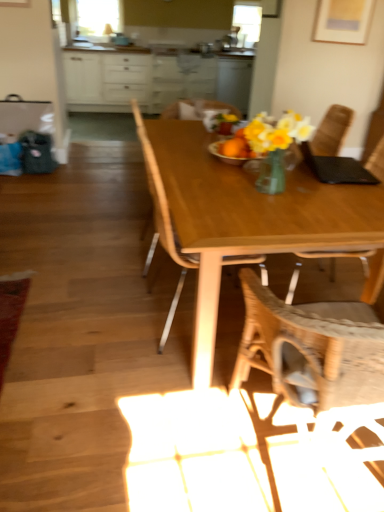
This screenshot has width=384, height=512. Describe the element at coordinates (162, 222) in the screenshot. I see `wooden chair at center, the first chair positioned from the left` at that location.

This screenshot has width=384, height=512. What do you see at coordinates (99, 18) in the screenshot?
I see `clear glass window screen at upper left` at bounding box center [99, 18].

Describe the element at coordinates (363, 288) in the screenshot. I see `wooden chair at center, marked as the third chair in a left-to-right arrangement` at that location.

In order to face wooden chair at center, positioned as the first chair in right-to-left order, should I rotate leftwards or rightwards?

Rotate your view right by about 18.159°.

The width and height of the screenshot is (384, 512). What do you see at coordinates (244, 217) in the screenshot?
I see `wooden table at center` at bounding box center [244, 217].

At what (x,y) coordinates should I click in order to perform the action: click on woven fabric chair at center, acting as the 2th chair starting from the left. Please return your answer as a coordinate pair (x, y). The width and height of the screenshot is (384, 512). Looking at the image, I should click on (313, 359).

Is white glossy cabinets at upper center in contact with wooden chair at center, positioned as the first chair in right-to-left order?

No, white glossy cabinets at upper center is not with wooden chair at center, positioned as the first chair in right-to-left order.

Looking at this image, considering the sizes of objects white glossy cabinets at upper center and wooden chair at center, positioned as the first chair in right-to-left order, in the image provided, who is wider, white glossy cabinets at upper center or wooden chair at center, positioned as the first chair in right-to-left order,?

Wider between the two is white glossy cabinets at upper center.

Is white glossy cabinets at upper center oriented away from wooden chair at center, positioned as the first chair in right-to-left order?

That's not correct — white glossy cabinets at upper center is not looking away from wooden chair at center, positioned as the first chair in right-to-left order.

Is white glossy cabinets at upper center positioned beyond the bounds of wooden table at center?

Absolutely, white glossy cabinets at upper center is external to wooden table at center.

Based on the photo, which is less distant, (122, 69) or (300, 212)?

Point (300, 212)

Is the surface of white glossy cabinets at upper center in direct contact with wooden table at center?

white glossy cabinets at upper center and wooden table at center are clearly separated.

Which of these two, clear glass window screen at upper left or wooden chair at center, which ranks as the third chair in right-to-left order, is wider?

With larger width is wooden chair at center, which ranks as the third chair in right-to-left order.

Identify the location of window screen that appears on the left of wooden chair at center, the first chair positioned from the left. (99, 18).

Could you tell me if clear glass window screen at upper left is turned towards wooden chair at center, which ranks as the third chair in right-to-left order?

Yes, clear glass window screen at upper left is facing wooden chair at center, which ranks as the third chair in right-to-left order.

From the picture: Considering the relative sizes of woven fabric chair at center, marked as the 2th chair in a right-to-left arrangement, and white glossy cabinets at upper center in the image provided, is woven fabric chair at center, marked as the 2th chair in a right-to-left arrangement, wider than white glossy cabinets at upper center?

No, woven fabric chair at center, marked as the 2th chair in a right-to-left arrangement, is not wider than white glossy cabinets at upper center.

Which object is closer to the camera, woven fabric chair at center, marked as the 2th chair in a right-to-left arrangement, or white glossy cabinets at upper center?

woven fabric chair at center, marked as the 2th chair in a right-to-left arrangement, is closer to the camera.

From the image's perspective, who appears lower, woven fabric chair at center, marked as the 2th chair in a right-to-left arrangement, or white glossy cabinets at upper center?

From the image's view, woven fabric chair at center, marked as the 2th chair in a right-to-left arrangement, is below.

I want to click on the 3rd chair below the white glossy cabinets at upper center (from the image's perspective), so click(313, 359).

At what (x,y) coordinates should I click in order to perform the action: click on the 3rd chair below the clear glass window screen at upper left (from the image's perspective). Please return your answer as a coordinate pair (x, y). The height and width of the screenshot is (512, 384). Looking at the image, I should click on (313, 359).

From the image's perspective, who appears lower, clear glass window screen at upper left or woven fabric chair at center, marked as the 2th chair in a right-to-left arrangement?

woven fabric chair at center, marked as the 2th chair in a right-to-left arrangement, from the image's perspective.

What's the angular difference between clear glass window screen at upper left and woven fabric chair at center, marked as the 2th chair in a right-to-left arrangement,'s facing directions?

178 degrees.

Measure the distance between clear glass window screen at upper left and woven fabric chair at center, acting as the 2th chair starting from the left.

5.34 meters.

Considering their positions, is wooden chair at center, the first chair positioned from the left, located in front of or behind woven fabric chair at center, acting as the 2th chair starting from the left?

wooden chair at center, the first chair positioned from the left, is behind woven fabric chair at center, acting as the 2th chair starting from the left.

Considering the relative positions of wooden chair at center, which ranks as the third chair in right-to-left order, and woven fabric chair at center, acting as the 2th chair starting from the left, in the image provided, is wooden chair at center, which ranks as the third chair in right-to-left order, to the left or to the right of woven fabric chair at center, acting as the 2th chair starting from the left,?

Based on their positions, wooden chair at center, which ranks as the third chair in right-to-left order, is located to the left of woven fabric chair at center, acting as the 2th chair starting from the left.

Looking at this image, considering the relative sizes of wooden chair at center, the first chair positioned from the left, and woven fabric chair at center, acting as the 2th chair starting from the left, in the image provided, is wooden chair at center, the first chair positioned from the left, bigger than woven fabric chair at center, acting as the 2th chair starting from the left,?

No.

Can we say wooden chair at center, which ranks as the third chair in right-to-left order, lies outside woven fabric chair at center, marked as the 2th chair in a right-to-left arrangement?

Yes, wooden chair at center, which ranks as the third chair in right-to-left order, is not within woven fabric chair at center, marked as the 2th chair in a right-to-left arrangement.

Would you say clear glass window screen at upper left is part of white glossy cabinets at upper center's contents?

No, clear glass window screen at upper left is located outside of white glossy cabinets at upper center.

Does white glossy cabinets at upper center lie in front of clear glass window screen at upper left?

Yes.

Which object is wider, white glossy cabinets at upper center or clear glass window screen at upper left?

Wider between the two is white glossy cabinets at upper center.

Considering the positions of objects white glossy cabinets at upper center and clear glass window screen at upper left in the image provided, who is more to the right, white glossy cabinets at upper center or clear glass window screen at upper left?

Positioned to the right is white glossy cabinets at upper center.

You are a GUI agent. You are given a task and a screenshot of the screen. Output one action in this format:
    pyautogui.click(x=<x>, y=<y>)
    Task: Click on the chair that is the 1st object located in front of the white glossy cabinets at upper center
    This screenshot has height=512, width=384.
    Given the screenshot: What is the action you would take?
    pyautogui.click(x=363, y=288)

Where is `cabinetry that is on the left side of wooden table at center`? cabinetry that is on the left side of wooden table at center is located at coordinates (152, 80).

From the picture: Which object lies nearer to the anchor point woven fabric chair at center, marked as the 2th chair in a right-to-left arrangement, wooden chair at center, which ranks as the third chair in right-to-left order, or wooden table at center?

Among the two, wooden table at center is located nearer to woven fabric chair at center, marked as the 2th chair in a right-to-left arrangement.

Looking at the image, which one is located further to clear glass window screen at upper left, woven fabric chair at center, acting as the 2th chair starting from the left, or wooden chair at center, which ranks as the third chair in right-to-left order?

woven fabric chair at center, acting as the 2th chair starting from the left, is positioned further to the anchor clear glass window screen at upper left.

When comparing their distances from white glossy cabinets at upper center, does wooden chair at center, marked as the third chair in a left-to-right arrangement, or wooden table at center seem further?

wooden chair at center, marked as the third chair in a left-to-right arrangement, lies further to white glossy cabinets at upper center than the other object.

Which object lies further to the anchor point clear glass window screen at upper left, white glossy cabinets at upper center or woven fabric chair at center, marked as the 2th chair in a right-to-left arrangement?

Among the two, woven fabric chair at center, marked as the 2th chair in a right-to-left arrangement, is located further to clear glass window screen at upper left.

Which object lies nearer to the anchor point wooden chair at center, the first chair positioned from the left, wooden table at center or wooden chair at center, positioned as the first chair in right-to-left order?

wooden table at center is closer to wooden chair at center, the first chair positioned from the left.

When comparing their distances from woven fabric chair at center, acting as the 2th chair starting from the left, does clear glass window screen at upper left or wooden chair at center, which ranks as the third chair in right-to-left order, seem further?

clear glass window screen at upper left is further to woven fabric chair at center, acting as the 2th chair starting from the left.

Estimate the real-world distances between objects in this image. Which object is further from wooden table at center, clear glass window screen at upper left or wooden chair at center, which ranks as the third chair in right-to-left order?

clear glass window screen at upper left.

Looking at the image, which one is located further to wooden table at center, wooden chair at center, which ranks as the third chair in right-to-left order, or clear glass window screen at upper left?

Based on the image, clear glass window screen at upper left appears to be further to wooden table at center.

Locate an element on the screen. cabinetry positioned between wooden chair at center, marked as the third chair in a left-to-right arrangement, and clear glass window screen at upper left from near to far is located at coordinates (152, 80).

In order to click on kitchen & dining room table between woven fabric chair at center, acting as the 2th chair starting from the left, and wooden chair at center, the first chair positioned from the left, in the front-back direction in this screenshot , I will do `click(244, 217)`.

You are a GUI agent. You are given a task and a screenshot of the screen. Output one action in this format:
    pyautogui.click(x=<x>, y=<y>)
    Task: Click on the kitchen & dining room table between woven fabric chair at center, acting as the 2th chair starting from the left, and clear glass window screen at upper left in the front-back direction
    
    Given the screenshot: What is the action you would take?
    pyautogui.click(x=244, y=217)

Locate an element on the screen. kitchen & dining room table between woven fabric chair at center, acting as the 2th chair starting from the left, and white glossy cabinets at upper center in the front-back direction is located at coordinates (244, 217).